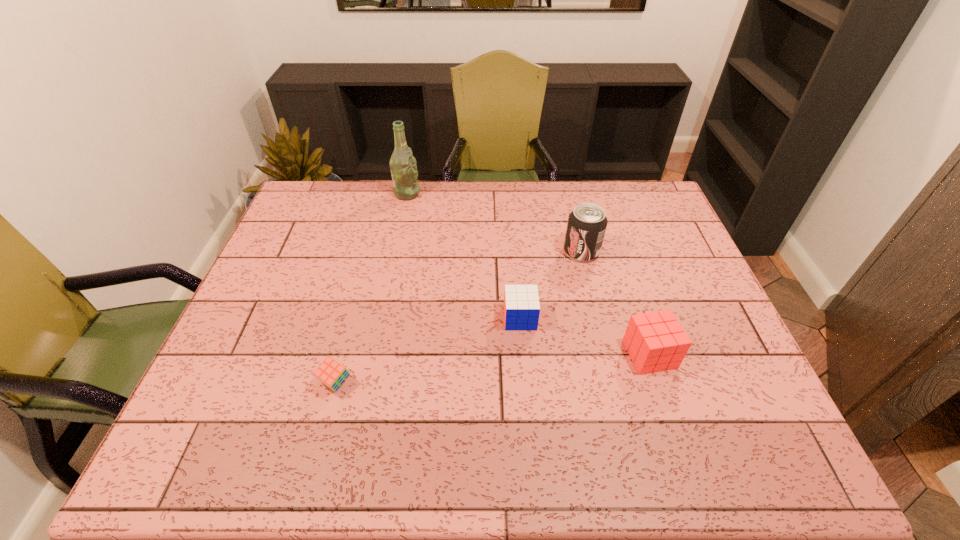
Where is `the tallest object`? The image size is (960, 540). the tallest object is located at coordinates (404, 173).

This screenshot has height=540, width=960. What are the coordinates of `beer bottle` in the screenshot? It's located at (404, 173).

The height and width of the screenshot is (540, 960). What are the coordinates of `the second farthest object` in the screenshot? It's located at (587, 223).

Where is `the fourth shortest object`? The image size is (960, 540). the fourth shortest object is located at coordinates (587, 223).

Where is `the third shortest object`? This screenshot has width=960, height=540. the third shortest object is located at coordinates (655, 341).

The image size is (960, 540). I want to click on the rightmost cube, so [655, 341].

Identify the location of the third farthest object. The width and height of the screenshot is (960, 540). (521, 302).

Find the location of `the second cube from left to right`. the second cube from left to right is located at coordinates (521, 302).

I want to click on the shortest cube, so click(x=330, y=372).

Locate an element on the screen. the leftmost cube is located at coordinates (330, 372).